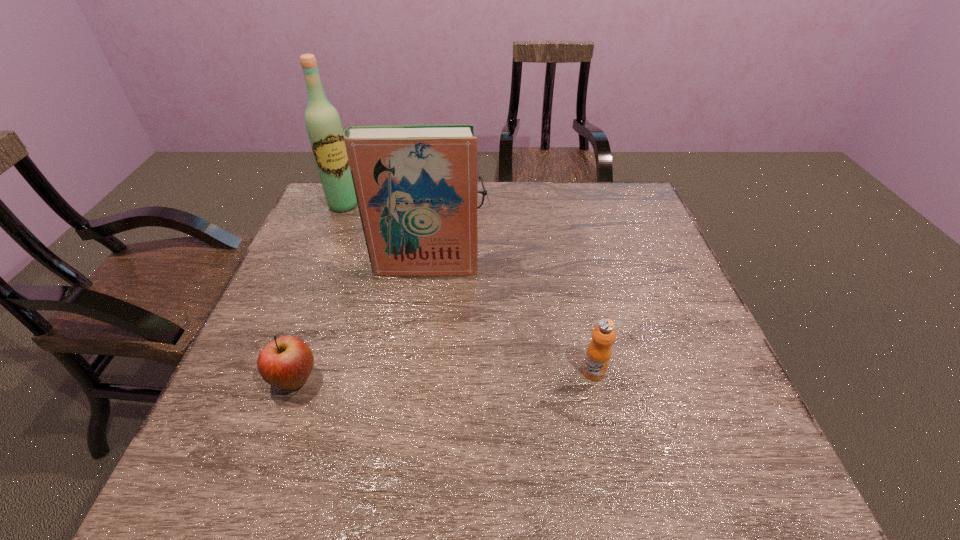
Locate an element on the screen. apple is located at coordinates (285, 363).

Locate an element on the screen. the third tallest object is located at coordinates (598, 354).

Find the location of a particular element. Image resolution: width=960 pixels, height=540 pixels. orange juice is located at coordinates (598, 354).

Find the location of `the fourth shortest object`. the fourth shortest object is located at coordinates (416, 186).

The width and height of the screenshot is (960, 540). Identify the location of hardback book. (416, 186).

Find the location of a particular element. spectacles is located at coordinates (484, 193).

Identify the location of wine bottle. (323, 124).

Identify the location of vacant space located on the right of the apple. (439, 380).

This screenshot has width=960, height=540. I want to click on vacant region located 0.070m on the front label of the rightmost object, so click(603, 412).

Locate an element on the screen. The height and width of the screenshot is (540, 960). blank area located 0.220m on the cover of the third farthest object is located at coordinates (418, 342).